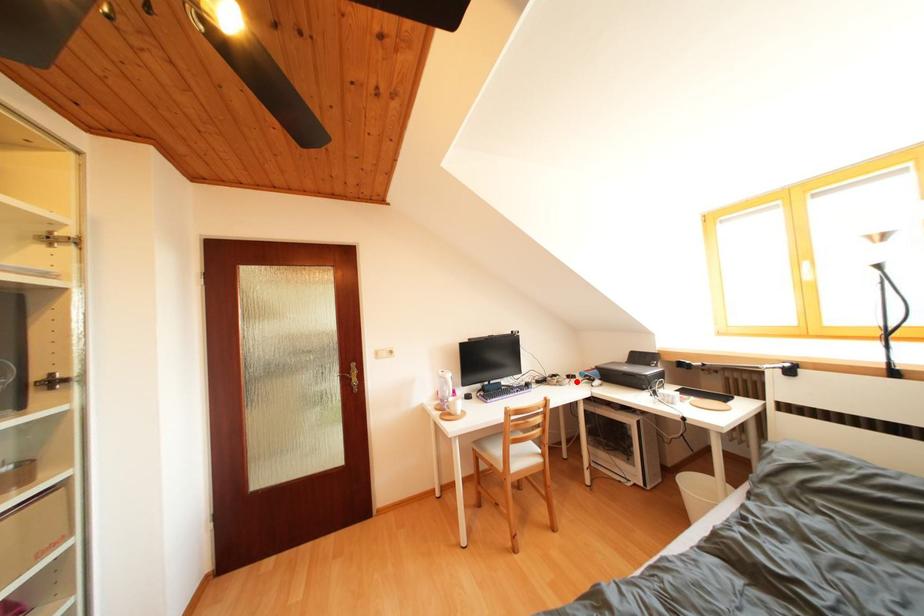
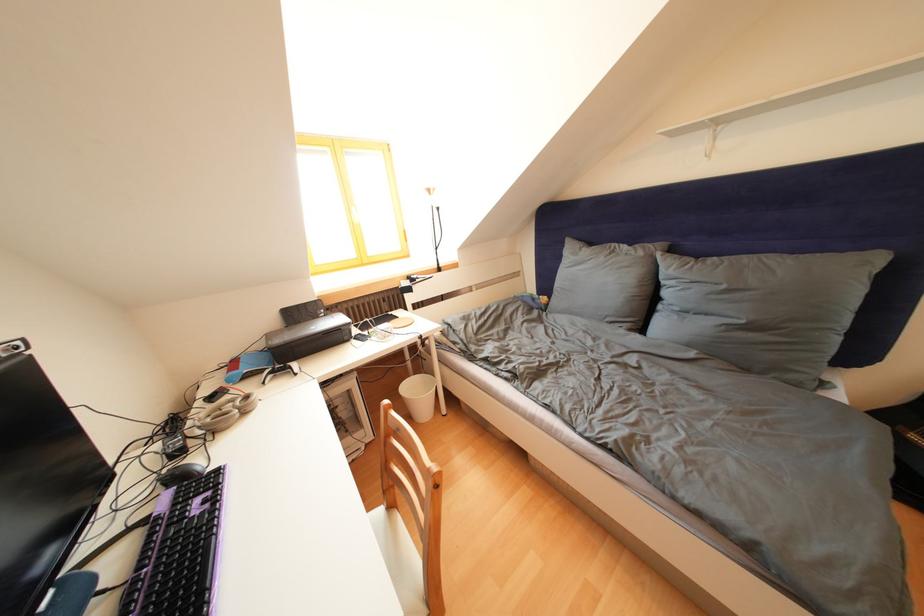
The point at the highlighted location is marked in the first image. Where is the corresponding point in the second image?

(220, 403)